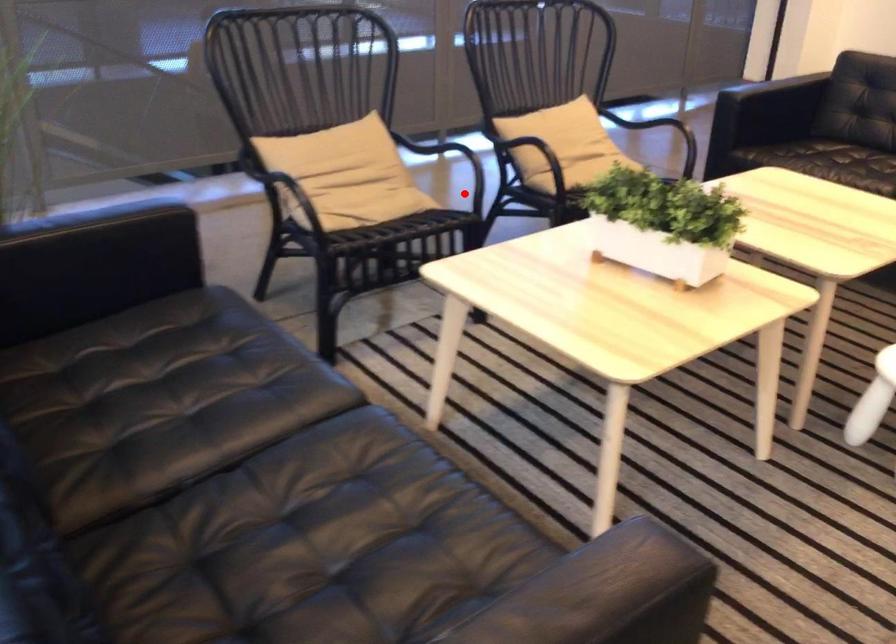
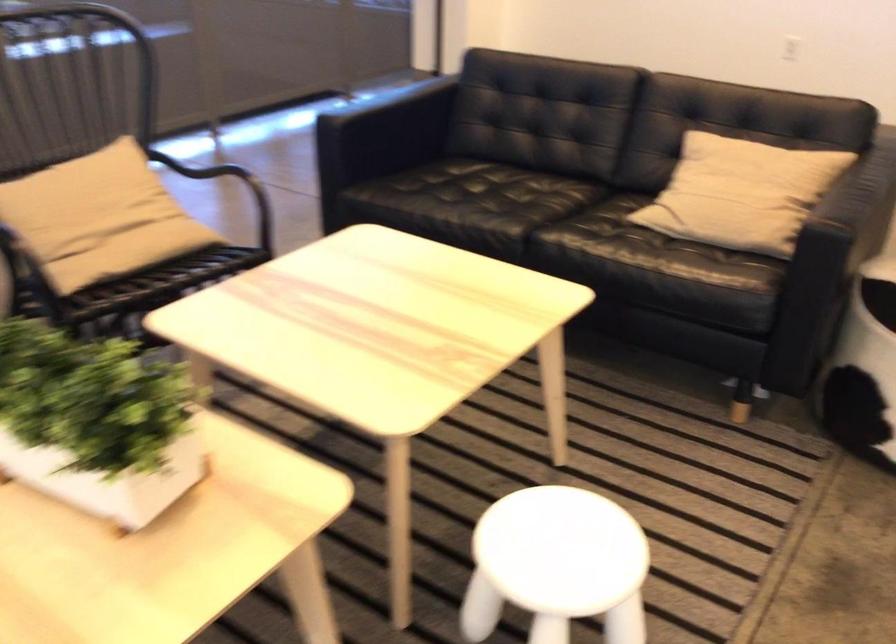
Find the pixel in the second image that matches the highlighted location in the first image.

(9, 288)